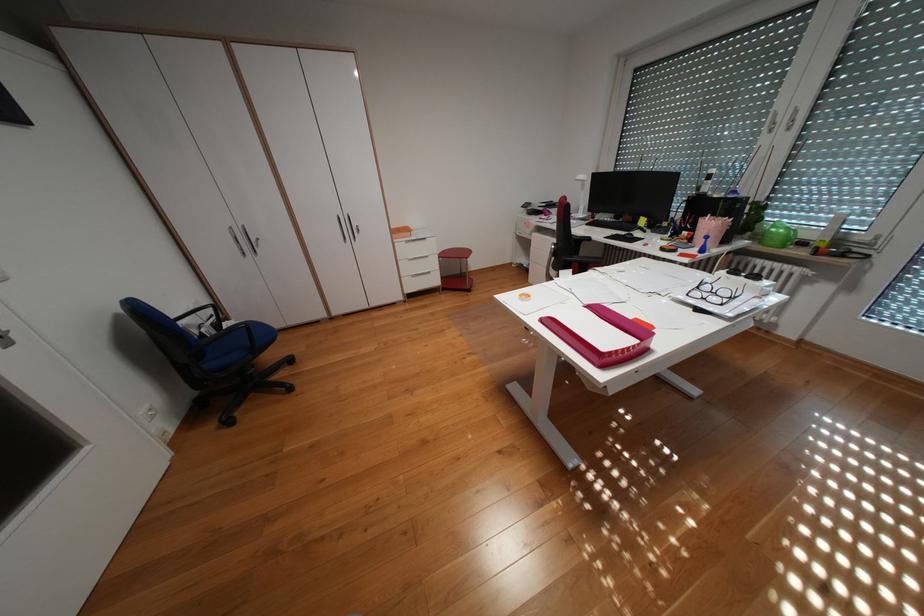
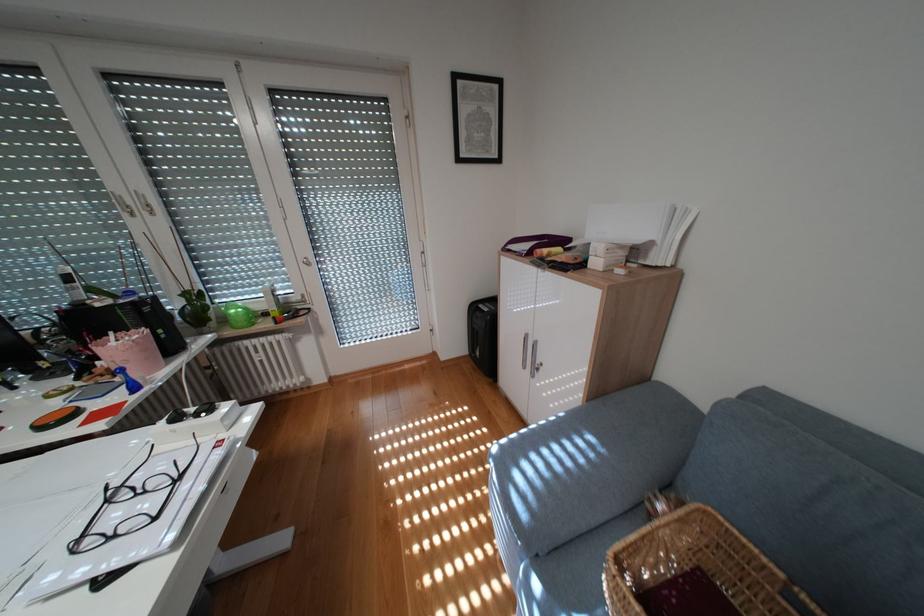
The point at [710,286] is marked in the first image. Where is the corresponding point in the second image?

(119, 501)